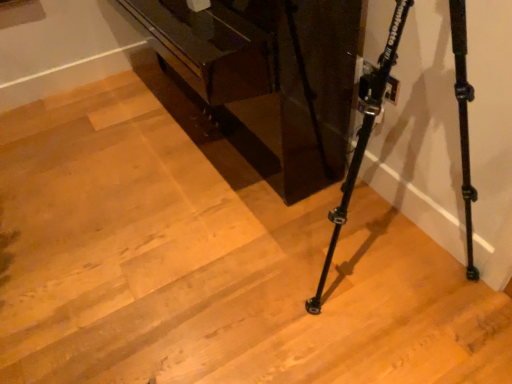
In order to click on space that is in front of glossy dark wood piano at center in this screenshot , I will do `click(163, 279)`.